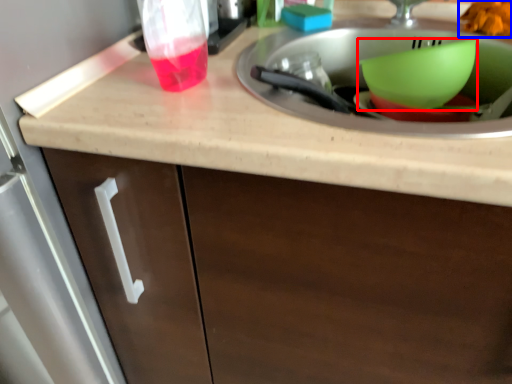
Question: Which point is closer to the camera, basin (highlighted by a red box) or food (highlighted by a blue box)?

Choices:
 (A) basin
 (B) food

Answer: (A)